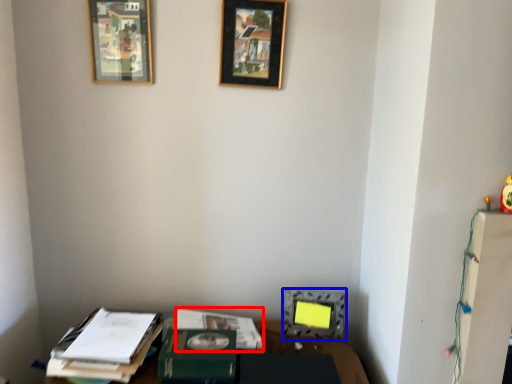
Question: Which point is further to the camera, journal (highlighted by a red box) or picture frame (highlighted by a blue box)?

Choices:
 (A) journal
 (B) picture frame

Answer: (B)